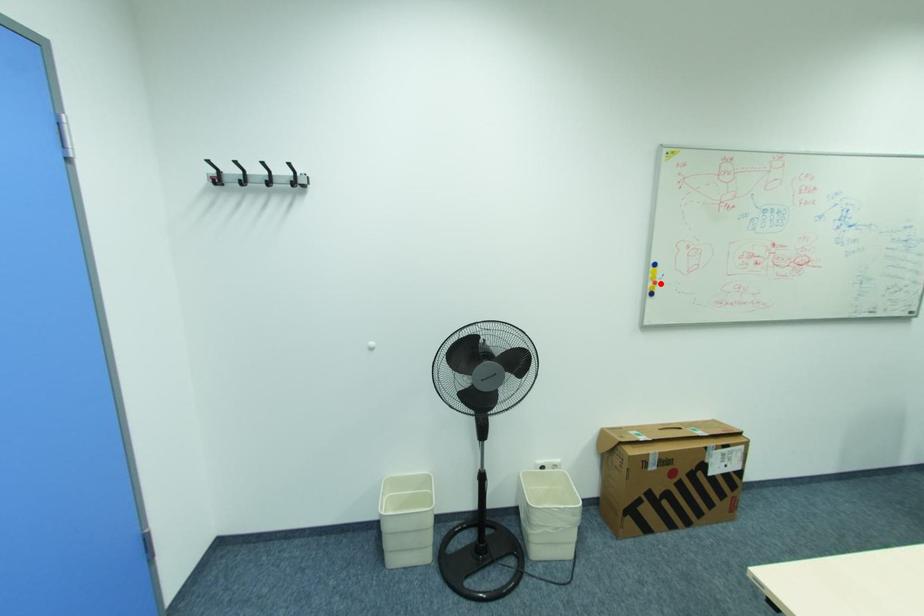
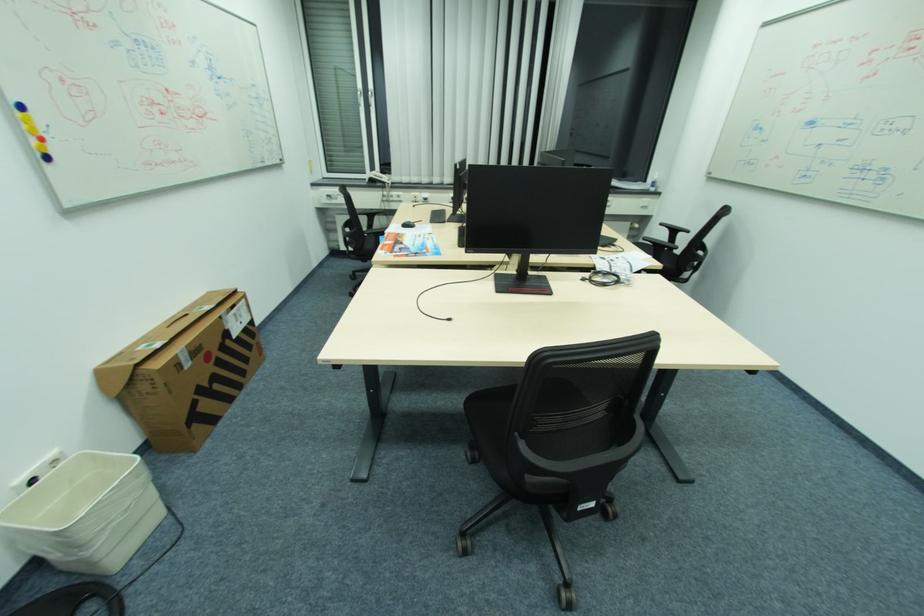
Where in the second image is the point corresponding to the highlighted location from the first image?

(44, 140)